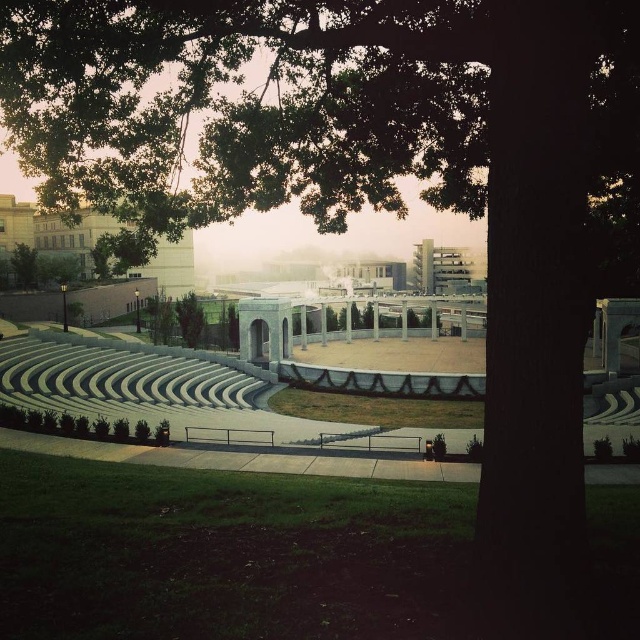
Based on the scene description, where is the white marble amphitheater at upper left located in terms of its 2D coordinates?

The white marble amphitheater at upper left is located at 2D coordinates point (52, 230).

You are standing in the middle of the amphitheater and want to take a photo that includes both the white marble amphitheater at upper left and the green leafy tree at left. Which object should you position closer to the center of your camera frame to ensure both fit in the shot?

Since the white marble amphitheater at upper left is bigger than the green leafy tree at left, you should position the white marble amphitheater at upper left closer to the center of your camera frame to ensure both fit in the shot.